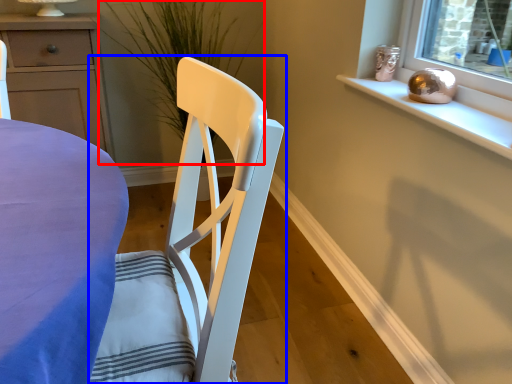
Question: Which point is closer to the camera, plant (highlighted by a red box) or chair (highlighted by a blue box)?

Choices:
 (A) plant
 (B) chair

Answer: (B)